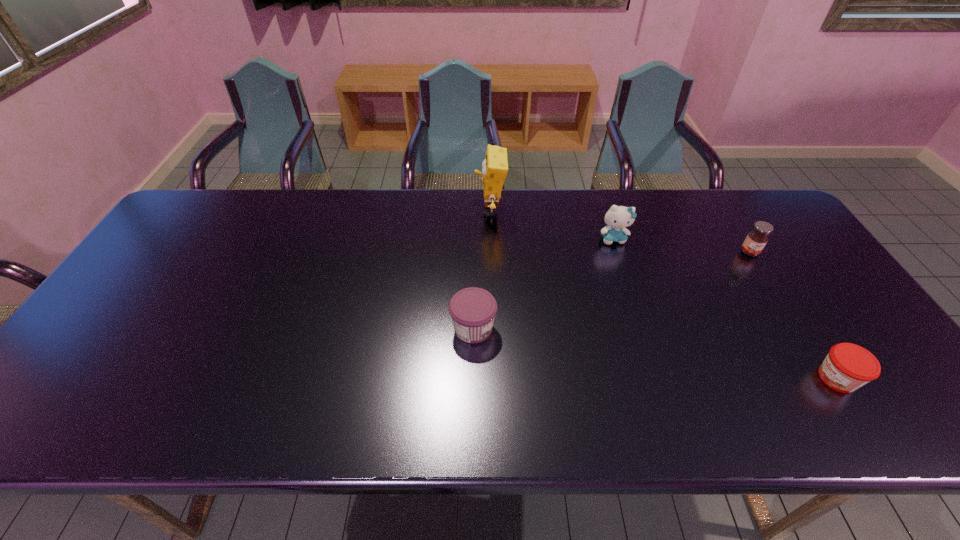
Identify the location of object at the near right corner. This screenshot has width=960, height=540. (847, 367).

Locate an element on the screen. The width and height of the screenshot is (960, 540). vacant region at the far edge is located at coordinates (397, 215).

Find the location of a particular element. The image size is (960, 540). vacant space at the near edge of the desktop is located at coordinates (833, 397).

Where is `vacant region at the right edge of the desktop`? Image resolution: width=960 pixels, height=540 pixels. vacant region at the right edge of the desktop is located at coordinates (880, 349).

Where is `blank area at the far left corner`? This screenshot has width=960, height=540. blank area at the far left corner is located at coordinates (195, 220).

Where is `vacant area at the far right corner of the desktop`? This screenshot has height=540, width=960. vacant area at the far right corner of the desktop is located at coordinates (773, 205).

This screenshot has width=960, height=540. Find the location of `free space between the shortest object and the leftmost jam`. free space between the shortest object and the leftmost jam is located at coordinates (655, 354).

The width and height of the screenshot is (960, 540). What are the coordinates of `free space between the nearest jam and the tallest object` in the screenshot? It's located at (663, 294).

Where is `empty location between the shortest object and the second nearest jam`? The width and height of the screenshot is (960, 540). empty location between the shortest object and the second nearest jam is located at coordinates (655, 354).

This screenshot has width=960, height=540. Identify the location of vacant area that lies between the kitten and the leftmost jam. [543, 284].